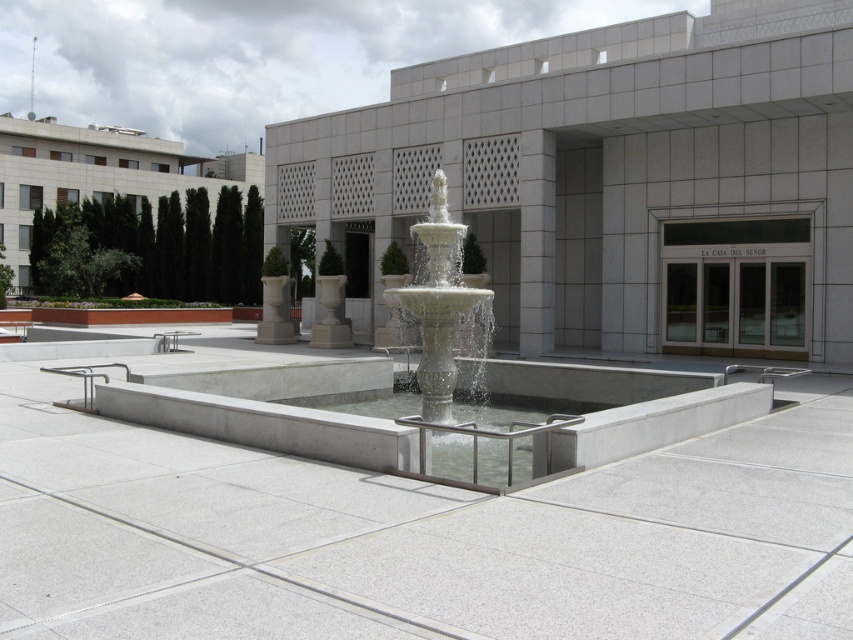
Question: Which object appears farthest from the camera in this image?

Choices:
 (A) white concrete fountain at center
 (B) white marble fountain at center
 (C) white smooth pillar at center

Answer: (C)

Question: Does white concrete fountain at center appear under white marble fountain at center?

Choices:
 (A) no
 (B) yes

Answer: (B)

Question: Which point is closer to the camera taking this photo?

Choices:
 (A) (518, 348)
 (B) (432, 406)
 (C) (589, 609)

Answer: (C)

Question: Does white marble fountain at center have a larger size compared to white smooth pillar at center?

Choices:
 (A) yes
 (B) no

Answer: (A)

Question: From the image, what is the correct spatial relationship of white concrete fountain at center in relation to white smooth pillar at center?

Choices:
 (A) below
 (B) above

Answer: (A)

Question: Which point is closer to the camera?

Choices:
 (A) (444, 294)
 (B) (526, 332)

Answer: (A)